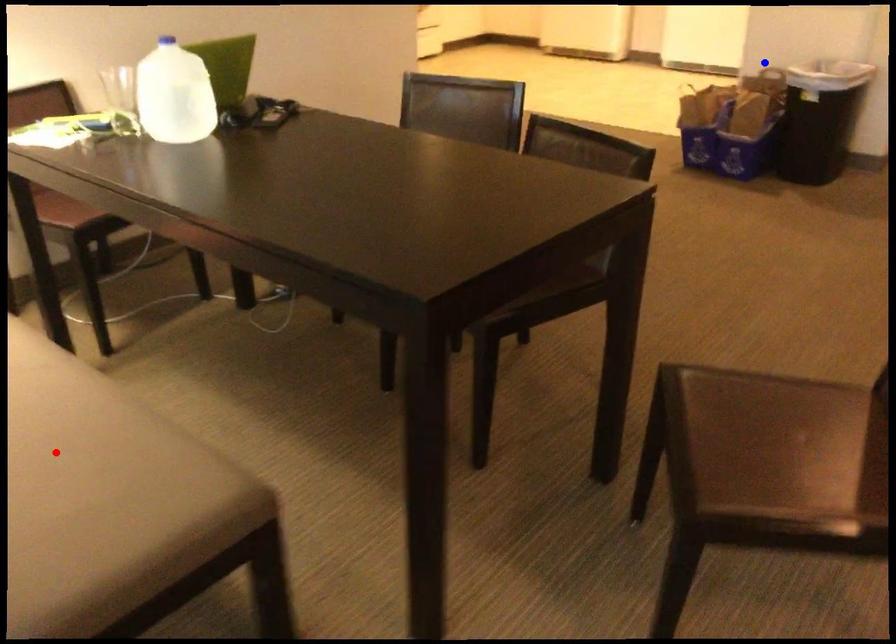
Question: In the image, two points are highlighted. Which point is nearer to the camera? Reply with the corresponding letter.

Choices:
 (A) blue point
 (B) red point

Answer: (B)